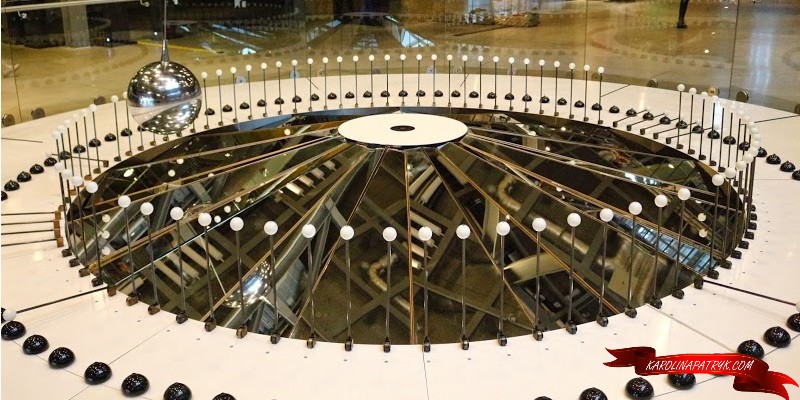
Identify the location of pendant. (164, 42).